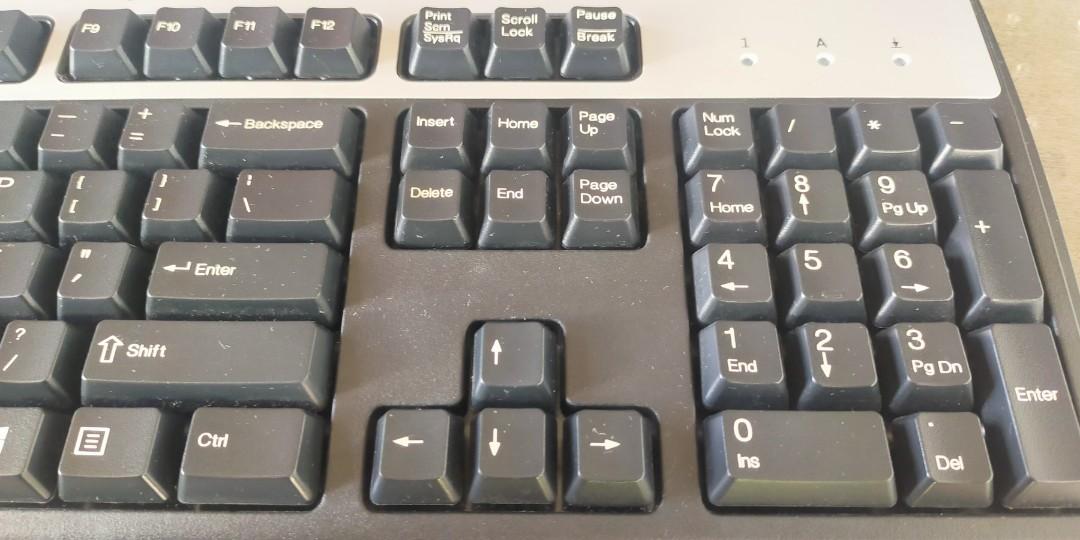
This screenshot has width=1080, height=540. Find the location of `silver of keyboard`. silver of keyboard is located at coordinates (702, 54).